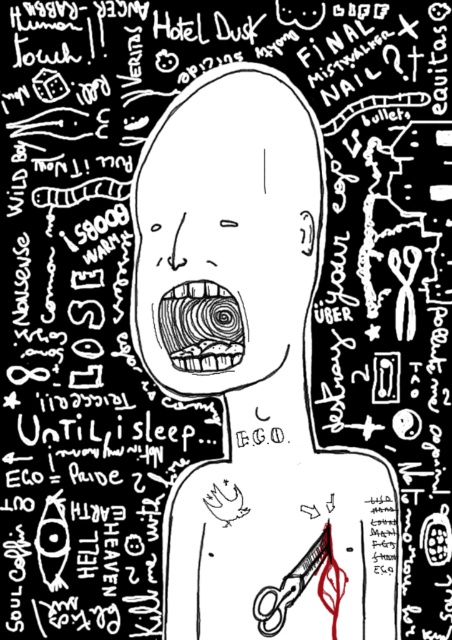
You are an artist analyzing the chaotic black and white illustration. You notice two points in the image at coordinates point (186, 288) and point (262, 614). Which point is positioned closer to your viewpoint?

Point (186, 288) is closer to the viewer than point (262, 614).

You are an artist analyzing this chaotic black and white illustration. You notice the smooth white head at center and the metallic sheen scissors at lower right. Which object is located to the right of the other?

The smooth white head at center is positioned on the left side of metallic sheen scissors at lower right, so the metallic sheen scissors at lower right are to the right of the smooth white head at center.

You are standing in front of the chaotic black and white illustration of the head with a swirling mouth. There are two points marked in the image at coordinates point (x=258, y=204) and point (x=299, y=589). From your perspective, which point is closer to you?

Point (x=258, y=204) is in front of point (x=299, y=589), so it is closer to you.